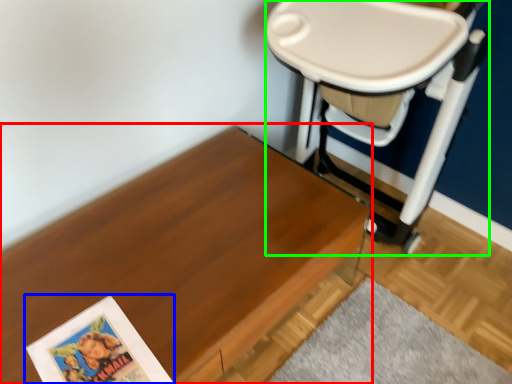
Question: Which object is the farthest from table (highlighted by a red box)? Choose among these: paperback book (highlighted by a blue box) or swivel chair (highlighted by a green box).

Choices:
 (A) paperback book
 (B) swivel chair

Answer: (B)